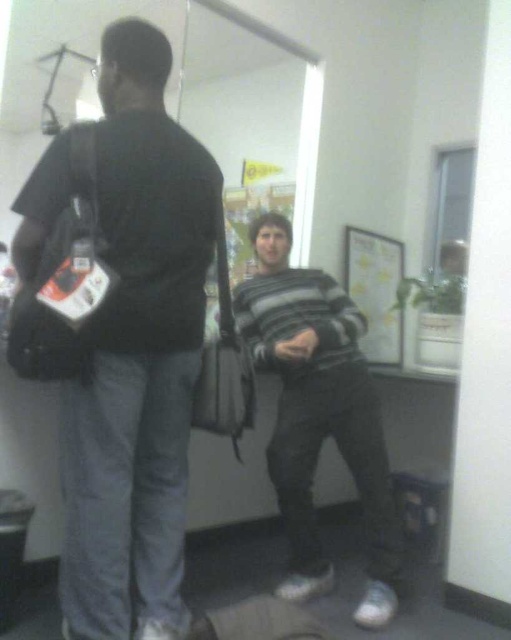
Based on the provided scene description, where is the black matte bag at left located in terms of coordinates?

The black matte bag at left is located at point coordinates of (121,336).

You are organizing a storage closet and need to place the black matte bag at left and the striped sweater at center into two shelves. The top shelf can only hold items smaller than the bottom shelf. Which object should go on the top shelf?

The striped sweater at center should be placed on the top shelf because the black matte bag at left is bigger and must go on the bottom shelf to support its weight.